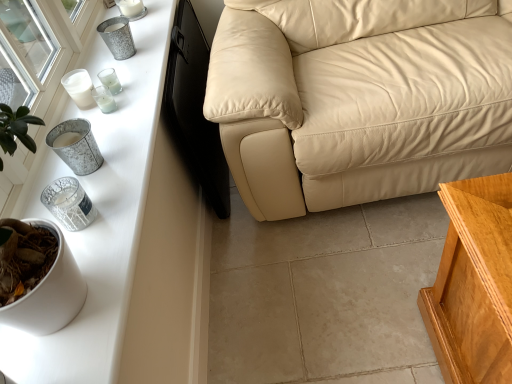
Question: Should I look upward or downward to see white glossy table at left?

Choices:
 (A) down
 (B) up

Answer: (B)

Question: Is metallic wire candle holder at left, which is the 1th candle holder from bottom to top, surrounded by beige leather couch at center?

Choices:
 (A) no
 (B) yes

Answer: (A)

Question: Does beige leather couch at center lie behind metallic wire candle holder at left, acting as the sixth candle holder starting from the top?

Choices:
 (A) no
 (B) yes

Answer: (A)

Question: Is beige leather couch at center oriented away from metallic wire candle holder at left, acting as the sixth candle holder starting from the top?

Choices:
 (A) no
 (B) yes

Answer: (A)

Question: Is beige leather couch at center at the left side of metallic wire candle holder at left, acting as the sixth candle holder starting from the top?

Choices:
 (A) yes
 (B) no

Answer: (B)

Question: From the image's perspective, does beige leather couch at center appear higher than metallic wire candle holder at left, acting as the sixth candle holder starting from the top?

Choices:
 (A) no
 (B) yes

Answer: (B)

Question: Considering the relative sizes of beige leather couch at center and metallic wire candle holder at left, which is the 1th candle holder from bottom to top, in the image provided, is beige leather couch at center bigger than metallic wire candle holder at left, which is the 1th candle holder from bottom to top,?

Choices:
 (A) no
 (B) yes

Answer: (B)

Question: Does metallic silver candle holder at left, the second candle holder in the bottom-to-top sequence, have a lesser height compared to metallic textured candle holder at upper left, acting as the sixth candle holder starting from the bottom?

Choices:
 (A) no
 (B) yes

Answer: (B)

Question: Considering the relative positions of metallic silver candle holder at left, which is the 5th candle holder from top to bottom, and metallic textured candle holder at upper left, which ranks as the 1th candle holder in top-to-bottom order, in the image provided, is metallic silver candle holder at left, which is the 5th candle holder from top to bottom, to the left of metallic textured candle holder at upper left, which ranks as the 1th candle holder in top-to-bottom order, from the viewer's perspective?

Choices:
 (A) yes
 (B) no

Answer: (B)

Question: Does metallic silver candle holder at left, the second candle holder in the bottom-to-top sequence, appear on the right side of metallic textured candle holder at upper left, which ranks as the 1th candle holder in top-to-bottom order?

Choices:
 (A) no
 (B) yes

Answer: (B)

Question: Would you consider metallic silver candle holder at left, the second candle holder in the bottom-to-top sequence, to be distant from metallic textured candle holder at upper left, acting as the sixth candle holder starting from the bottom?

Choices:
 (A) yes
 (B) no

Answer: (B)

Question: Can you confirm if metallic silver candle holder at left, which is the 5th candle holder from top to bottom, is smaller than metallic textured candle holder at upper left, acting as the sixth candle holder starting from the bottom?

Choices:
 (A) no
 (B) yes

Answer: (A)

Question: Is metallic silver candle holder at left, the second candle holder in the bottom-to-top sequence, wider than metallic textured candle holder at upper left, acting as the sixth candle holder starting from the bottom?

Choices:
 (A) no
 (B) yes

Answer: (B)

Question: Is metallic silver candle holder at left, which is the 5th candle holder from top to bottom, to the right of beige leather couch at center from the viewer's perspective?

Choices:
 (A) no
 (B) yes

Answer: (A)